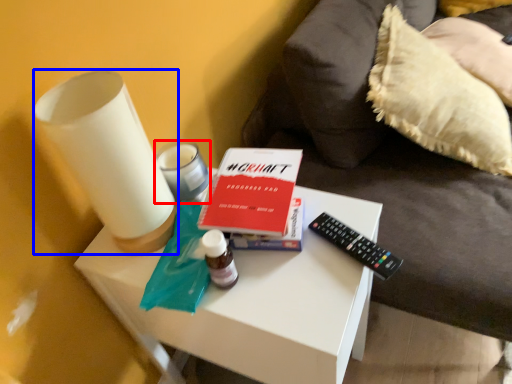
Question: Which of the following is the farthest to the observer, candle holder (highlighted by a red box) or candle holder (highlighted by a blue box)?

Choices:
 (A) candle holder
 (B) candle holder

Answer: (A)